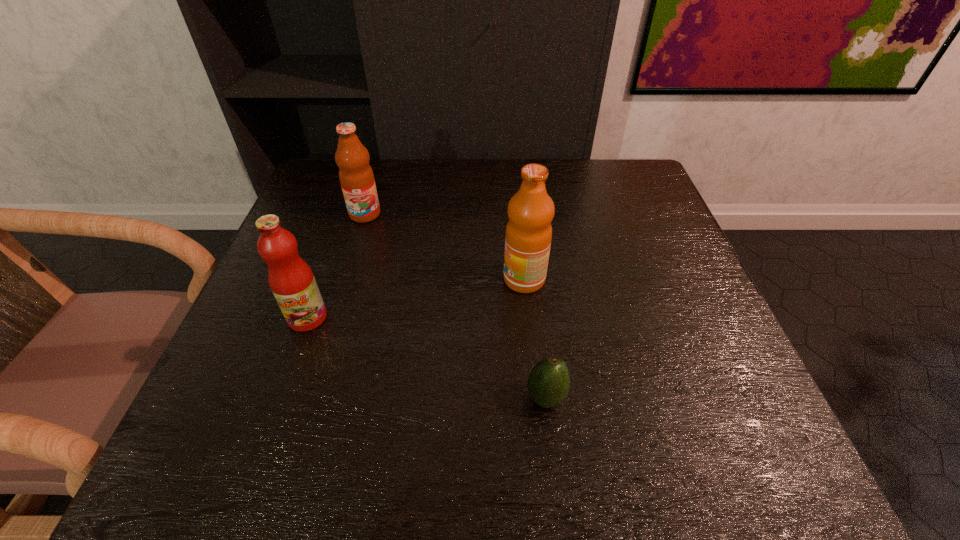
Find the location of a particular element. This screenshot has height=540, width=960. the third nearest object is located at coordinates (528, 236).

The image size is (960, 540). I want to click on the rightmost fruit juice, so click(528, 236).

The height and width of the screenshot is (540, 960). Find the location of `the nearest fruit juice`. the nearest fruit juice is located at coordinates (292, 282).

You are a GUI agent. You are given a task and a screenshot of the screen. Output one action in this format:
    pyautogui.click(x=<x>, y=<y>)
    Task: Click on the farthest fruit juice
    Image resolution: width=960 pixels, height=540 pixels.
    Given the screenshot: What is the action you would take?
    pyautogui.click(x=356, y=176)

At what (x,y) coordinates should I click in order to perform the action: click on the nearest object. Please return your answer as a coordinate pair (x, y). Looking at the image, I should click on (548, 383).

Identify the location of avocado. The image size is (960, 540). pos(548,383).

You are a GUI agent. You are given a task and a screenshot of the screen. Output one action in this format:
    pyautogui.click(x=<x>, y=<y>)
    Task: Click on the blank space located on the label side of the rightmost fruit juice
    The image size is (960, 540).
    Given the screenshot: What is the action you would take?
    [x=361, y=280]

Locate an element on the screen. The height and width of the screenshot is (540, 960). vacant space situated 0.170m on the label side of the rightmost fruit juice is located at coordinates (425, 280).

The height and width of the screenshot is (540, 960). Find the location of `vacant point located 0.100m on the label side of the rightmost fruit juice`. vacant point located 0.100m on the label side of the rightmost fruit juice is located at coordinates (457, 280).

The width and height of the screenshot is (960, 540). Find the location of `vacant space located 0.070m on the front label of the nearest fruit juice`. vacant space located 0.070m on the front label of the nearest fruit juice is located at coordinates (291, 363).